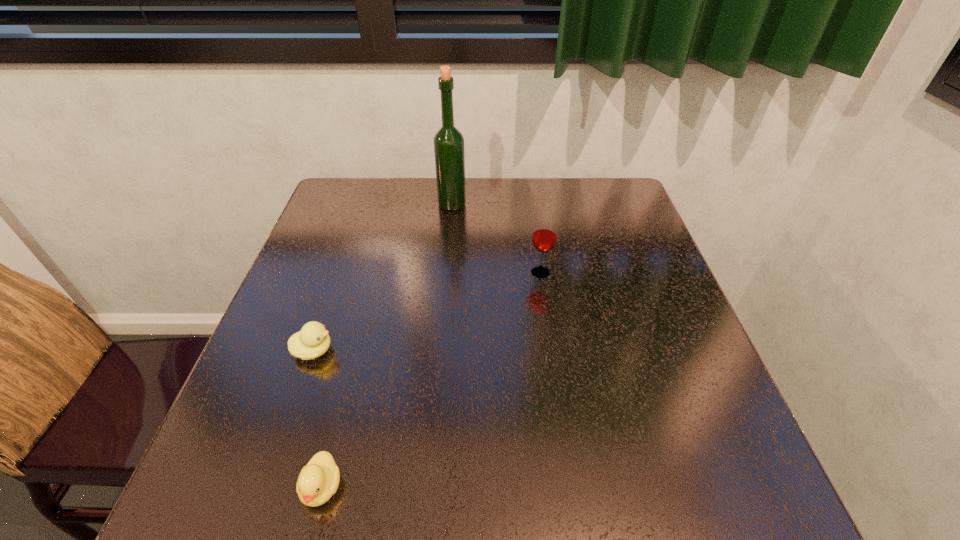
I want to click on free space located at the beak of the second nearest object, so click(x=428, y=350).

At what (x,y) coordinates should I click in order to perform the action: click on object located at the far edge. Please return your answer as a coordinate pair (x, y). This screenshot has width=960, height=540. Looking at the image, I should click on (449, 152).

At what (x,y) coordinates should I click in order to perform the action: click on object located at the near edge. Please return your answer as a coordinate pair (x, y). This screenshot has width=960, height=540. Looking at the image, I should click on (318, 480).

You are a GUI agent. You are given a task and a screenshot of the screen. Output one action in this format:
    pyautogui.click(x=<x>, y=<y>)
    Task: Click on the object positioned at the left edge
    This screenshot has height=540, width=960.
    Given the screenshot: What is the action you would take?
    pyautogui.click(x=312, y=341)

The width and height of the screenshot is (960, 540). In order to click on free space at the far edge of the desktop in this screenshot , I will do `click(414, 220)`.

Where is `free region at the near edge of the desktop`? This screenshot has width=960, height=540. free region at the near edge of the desktop is located at coordinates (397, 495).

This screenshot has height=540, width=960. Find the location of `free space at the left edge of the desktop`. free space at the left edge of the desktop is located at coordinates (273, 395).

In the image, there is a desktop. Identify the location of vacant space at the right edge. The height and width of the screenshot is (540, 960). (711, 427).

Identify the location of vacant space at the far left corner of the desktop. (373, 185).

Find the location of a particular element. blank space at the far right corner of the desktop is located at coordinates (599, 197).